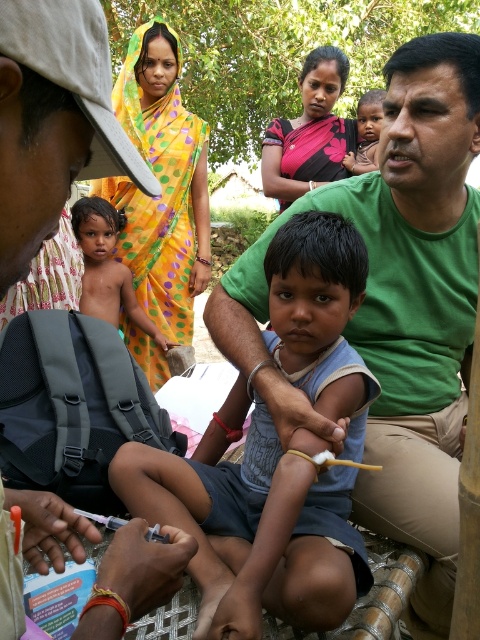
Question: Estimate the real-world distances between objects in this image. Which object is closer to the polka dot sari at center?

Choices:
 (A) green matte shirt at upper right
 (B) yellow dotted sari at upper left
 (C) light blue fabric shirt at center
 (D) green cotton shirt at upper right

Answer: (B)

Question: Considering the real-world distances, which object is farthest from the light blue fabric shirt at center?

Choices:
 (A) green matte shirt at upper right
 (B) green cotton shirt at upper right

Answer: (A)

Question: Is green matte shirt at upper right positioned in front of polka dot sari at center?

Choices:
 (A) no
 (B) yes

Answer: (B)

Question: Can you confirm if green matte shirt at upper right is positioned to the left of matte skin child at center?

Choices:
 (A) yes
 (B) no

Answer: (A)

Question: Can you confirm if green matte shirt at upper right is bigger than yellow dotted sari at upper left?

Choices:
 (A) no
 (B) yes

Answer: (A)

Question: Which of the following is the closest to the observer?

Choices:
 (A) light blue fabric shirt at center
 (B) green matte shirt at upper right

Answer: (B)